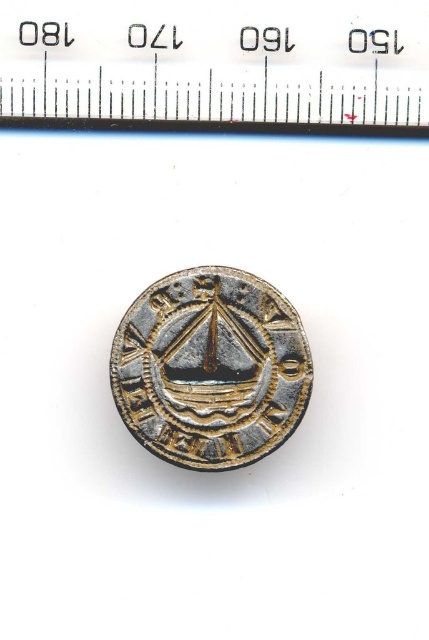
Question: Is metallic ruler at upper center below gold plated coin at center?

Choices:
 (A) no
 (B) yes

Answer: (A)

Question: Observing the image, what is the correct spatial positioning of metallic ruler at upper center in reference to gold plated coin at center?

Choices:
 (A) above
 (B) below

Answer: (A)

Question: Is metallic ruler at upper center positioned at the back of gold plated coin at center?

Choices:
 (A) yes
 (B) no

Answer: (B)

Question: Which point is closer to the camera taking this photo?

Choices:
 (A) (220, 308)
 (B) (332, 60)

Answer: (A)